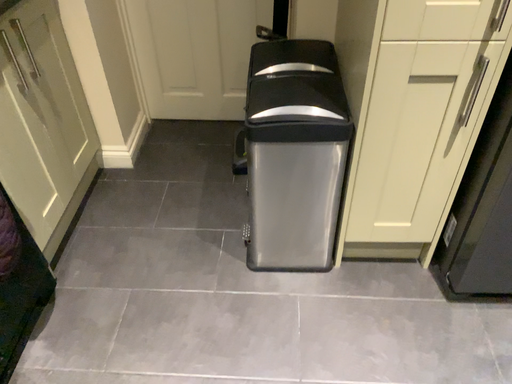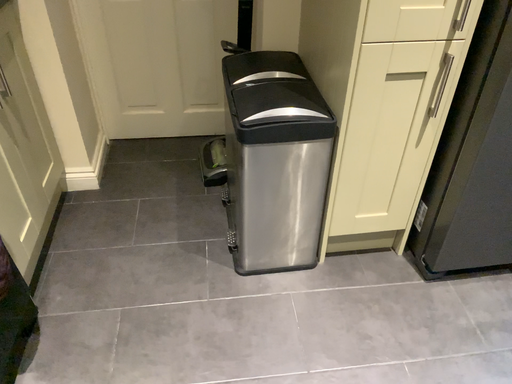
Question: Which way did the camera rotate in the video?

Choices:
 (A) rotated left
 (B) rotated right

Answer: (B)